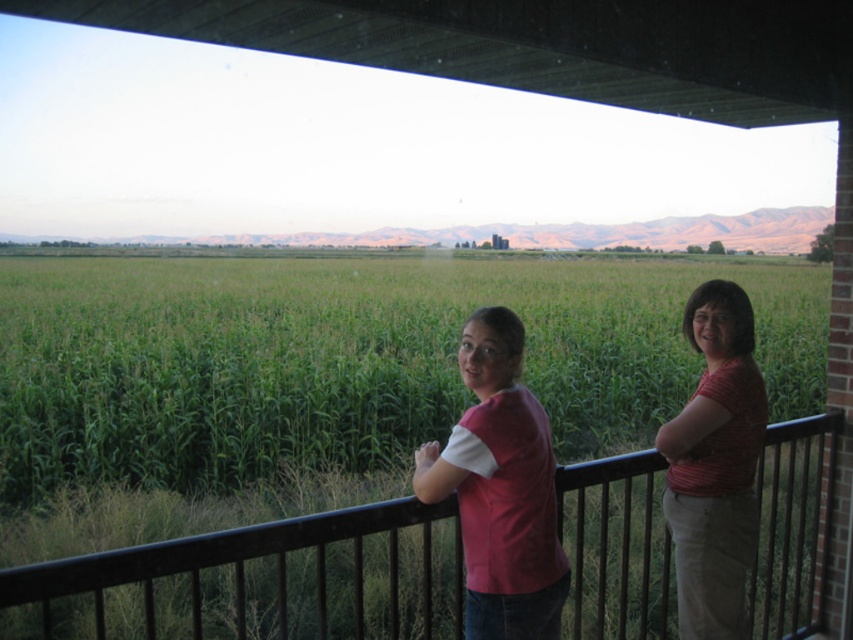
Does black metal railing at lower center appear on the right side of pink cotton shirt at center?

In fact, black metal railing at lower center is to the left of pink cotton shirt at center.

Is point (387, 624) less distant than point (511, 426)?

No, (387, 624) is behind (511, 426).

Who is more distant from viewer, (265, 596) or (479, 627)?

Positioned behind is point (265, 596).

Where is `black metal railing at lower center`? black metal railing at lower center is located at coordinates (259, 568).

What do you see at coordinates (347, 358) in the screenshot?
I see `green grassy corn field at center` at bounding box center [347, 358].

Is green grassy corn field at center taller than pink cotton shirt at center?

Yes, green grassy corn field at center is taller than pink cotton shirt at center.

Consider the image. Measure the distance between point (258, 346) and camera.

Point (258, 346) is 11.76 meters away from camera.

Where is `green grassy corn field at center`? The image size is (853, 640). green grassy corn field at center is located at coordinates (347, 358).

From the picture: Who is higher up, green grassy corn field at center or matte pink shirt at right?

green grassy corn field at center is higher up.

Who is more forward, (393, 433) or (741, 561)?

Point (741, 561) is more forward.

Find the location of a particular element. The image size is (853, 640). green grassy corn field at center is located at coordinates (347, 358).

Where is `green grassy corn field at center`? green grassy corn field at center is located at coordinates (347, 358).